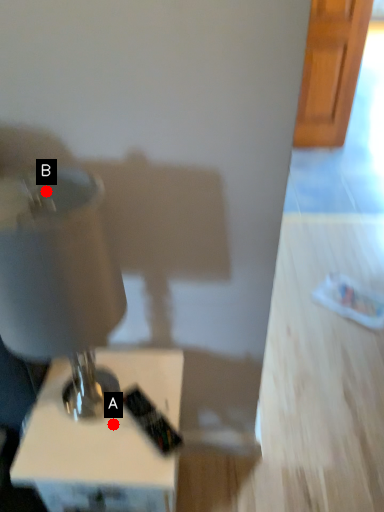
Question: Two points are circled on the image, labeled by A and B beside each circle. Among these points, which one is farthest from the camera?

Choices:
 (A) A is further
 (B) B is further

Answer: (A)